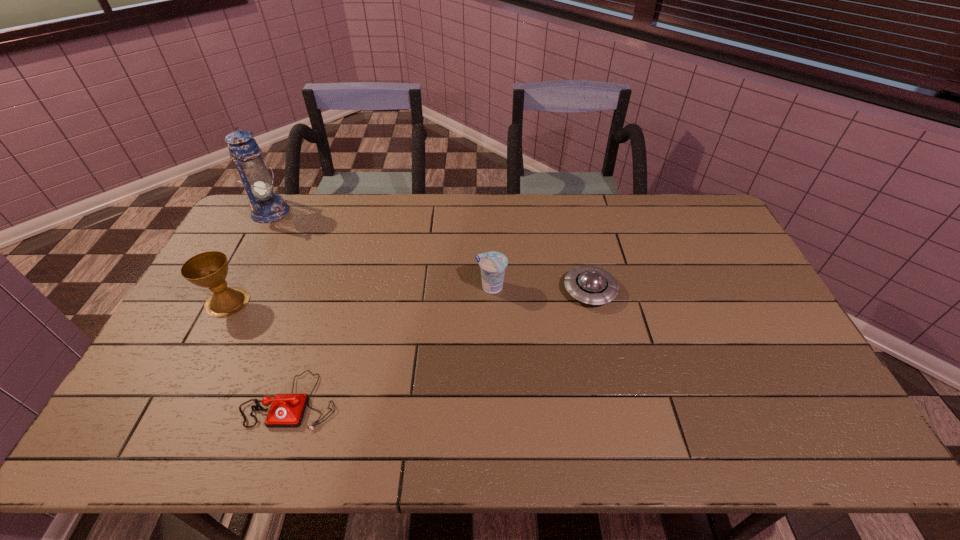
Identify the location of vacant area that lies between the chalice and the yogurt. (359, 294).

What are the coordinates of `object that ranks as the second closest to the rightmost object` in the screenshot? It's located at (287, 410).

Identify which object is the closest to the saucer. Please provide its 2D coordinates. Your answer should be formatted as a tuple, i.e. [(x, y)], where the tuple contains the x and y coordinates of a point satisfying the conditions above.

[(492, 264)]

The width and height of the screenshot is (960, 540). I want to click on free region that satisfies the following two spatial constraints: 1. on the front-facing side of the lantern; 2. on the back side of the saucer, so 228,291.

Identify the location of free spot that satisfies the following two spatial constraints: 1. on the front-facing side of the saucer; 2. on the right side of the tallest object. Image resolution: width=960 pixels, height=540 pixels. (228, 291).

Image resolution: width=960 pixels, height=540 pixels. Identify the location of vacant region that satisfies the following two spatial constraints: 1. on the front-facing side of the tallest object; 2. on the left side of the second tallest object. (222, 302).